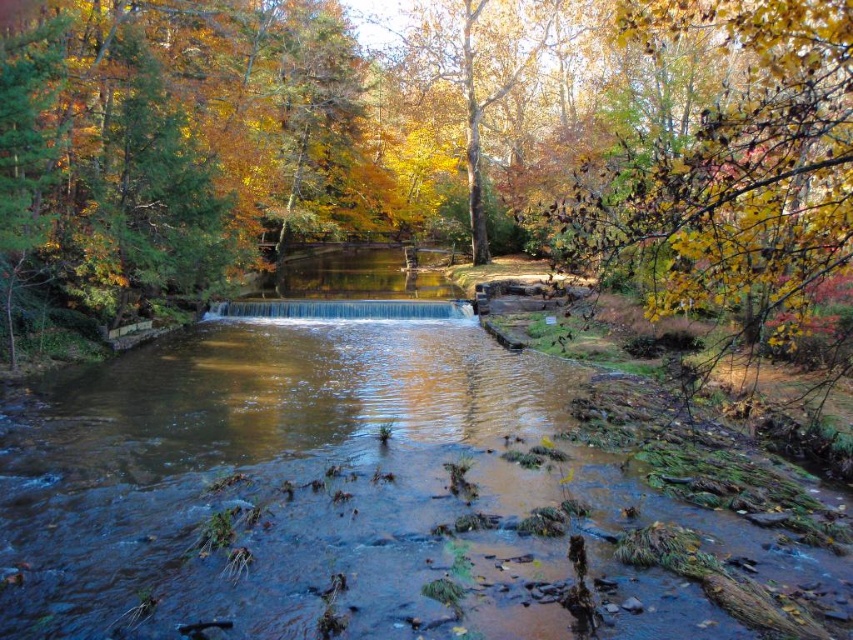
You are an artist planning to paint the autumn scene. You want to ensure the brown smooth water at center and the yellow leafy branch at upper right are both included. Which object should you paint first if you follow the rule of painting smaller objects before larger ones?

The brown smooth water at center should be painted first because it is smaller than the yellow leafy branch at upper right according to the description.

You are standing at a viewpoint overlooking the waterfall and want to know how far you are from the point marked as point [399,420]. Can you determine the distance?

The distance between you and point [399,420] is 41.38 feet.

From the picture: You are a photographer wanting to capture the brown smooth water at center and the yellow leafy branch at upper right in one frame. Based on their positions, which object is positioned closer to the camera?

The brown smooth water at center is positioned closer to the camera than the yellow leafy branch at upper right because the branch is placed higher up in the frame, typically indicating it is farther away.